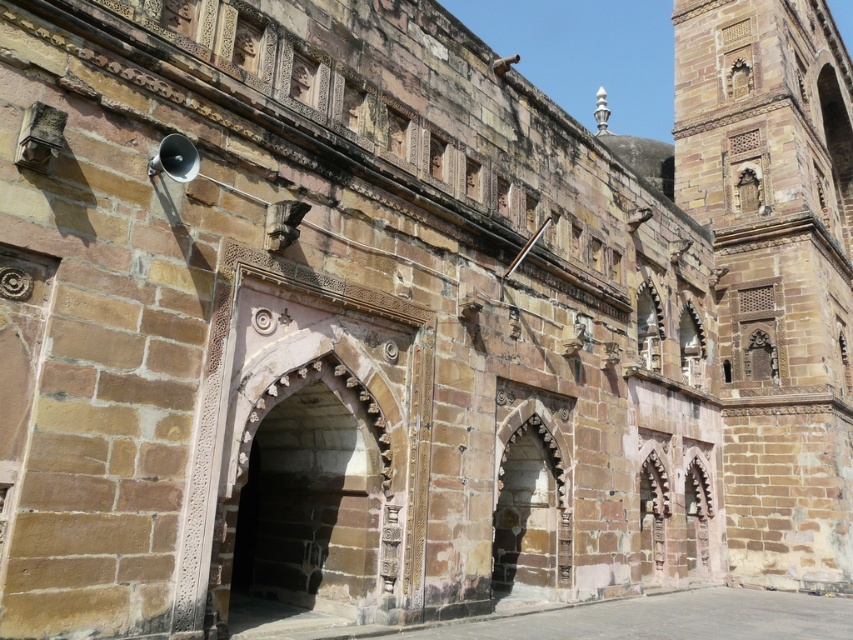
You are an architect examining the historical stone structure. You need to determine which of the two main features, the brown stone tower at right or the stone textured archway at center, is wider. Based on the scene description, which one has a greater width?

The brown stone tower at right is wider than the stone textured archway at center according to the description provided.